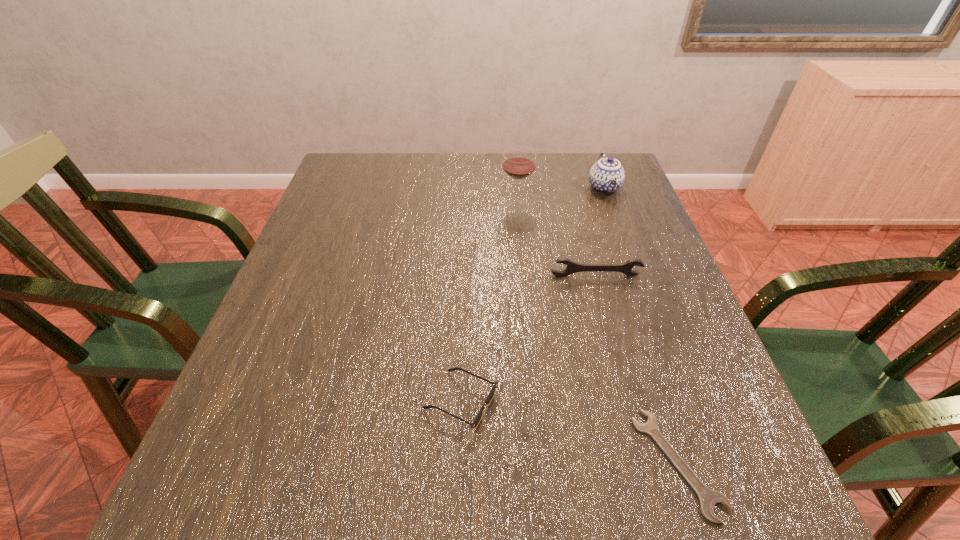
I want to click on the second object from left to right, so click(x=519, y=163).

Find the location of a particular element. wineglass is located at coordinates (519, 163).

The height and width of the screenshot is (540, 960). Find the location of `chinaware`. chinaware is located at coordinates (607, 175).

Where is `the taller wrench`? Image resolution: width=960 pixels, height=540 pixels. the taller wrench is located at coordinates (572, 267).

Identify the location of the third farthest object. (572, 267).

This screenshot has width=960, height=540. I want to click on sunglasses, so click(x=476, y=421).

What are the coordinates of `the fourth tallest object` in the screenshot? It's located at (476, 421).

Identify the location of the nearer wrench. (708, 498).

Image resolution: width=960 pixels, height=540 pixels. Identify the location of the shortest object. (708, 498).

The width and height of the screenshot is (960, 540). I want to click on vacant space situated 0.080m on the left of the wineglass, so click(x=471, y=205).